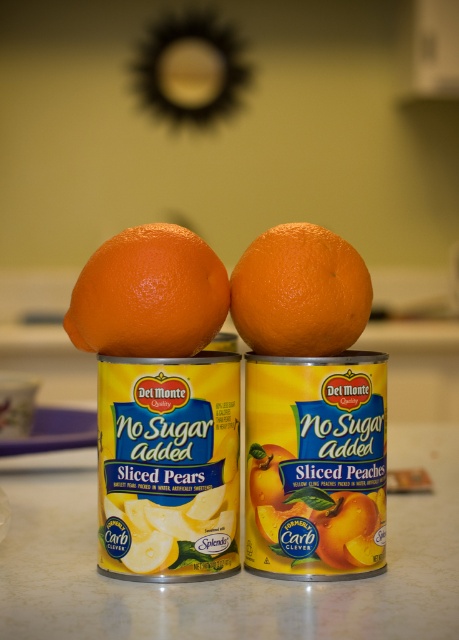
Question: Which object is farther from the camera taking this photo?

Choices:
 (A) orangesmoothorange at right
 (B) orangesmoothorange at left

Answer: (A)

Question: Which of the following is the closest to the observer?

Choices:
 (A) (281, 301)
 (B) (212, 317)

Answer: (A)

Question: Is orangesmoothorange at left positioned in front of orangesmoothorange at right?

Choices:
 (A) yes
 (B) no

Answer: (A)

Question: Considering the relative positions of orangesmoothorange at left and orangesmoothorange at right in the image provided, where is orangesmoothorange at left located with respect to orangesmoothorange at right?

Choices:
 (A) above
 (B) below

Answer: (B)

Question: Which object is farther from the camera taking this photo?

Choices:
 (A) orangesmoothorange at left
 (B) orangesmoothorange at right

Answer: (B)

Question: Is orangesmoothorange at left positioned behind orangesmoothorange at right?

Choices:
 (A) no
 (B) yes

Answer: (A)